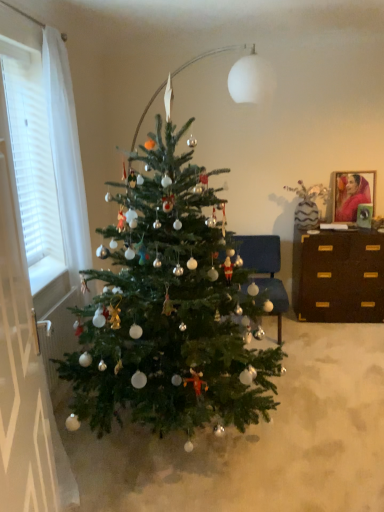
Question: Is blue fabric chair at center wider than green matte christmas tree at center?

Choices:
 (A) yes
 (B) no

Answer: (B)

Question: Is the position of blue fabric chair at center more distant than that of green matte christmas tree at center?

Choices:
 (A) yes
 (B) no

Answer: (A)

Question: Can you confirm if blue fabric chair at center is bigger than green matte christmas tree at center?

Choices:
 (A) no
 (B) yes

Answer: (A)

Question: Is blue fabric chair at center in front of green matte christmas tree at center?

Choices:
 (A) yes
 (B) no

Answer: (B)

Question: From the image's perspective, is blue fabric chair at center on green matte christmas tree at center?

Choices:
 (A) yes
 (B) no

Answer: (B)

Question: Visually, is white textured curtain at left positioned to the left or to the right of matte red fabric portrait at upper right?

Choices:
 (A) left
 (B) right

Answer: (A)

Question: Choose the correct answer: Is white textured curtain at left inside matte red fabric portrait at upper right or outside it?

Choices:
 (A) outside
 (B) inside

Answer: (A)

Question: Does point (46, 203) appear closer or farther from the camera than point (362, 186)?

Choices:
 (A) closer
 (B) farther

Answer: (A)

Question: Considering the positions of white textured curtain at left and matte red fabric portrait at upper right in the image, is white textured curtain at left bigger or smaller than matte red fabric portrait at upper right?

Choices:
 (A) small
 (B) big

Answer: (B)

Question: Would you say green matte christmas tree at center is inside or outside white textured curtain at left?

Choices:
 (A) inside
 (B) outside

Answer: (B)

Question: In the image, is green matte christmas tree at center positioned in front of or behind white textured curtain at left?

Choices:
 (A) behind
 (B) front

Answer: (A)

Question: Based on their positions, is green matte christmas tree at center located to the left or right of white textured curtain at left?

Choices:
 (A) left
 (B) right

Answer: (B)

Question: Does point (215, 327) appear closer or farther from the camera than point (14, 152)?

Choices:
 (A) closer
 (B) farther

Answer: (A)

Question: In terms of height, does matte red fabric portrait at upper right look taller or shorter compared to blue fabric chair at center?

Choices:
 (A) short
 (B) tall

Answer: (A)

Question: From the image's perspective, is matte red fabric portrait at upper right located above or below blue fabric chair at center?

Choices:
 (A) above
 (B) below

Answer: (A)